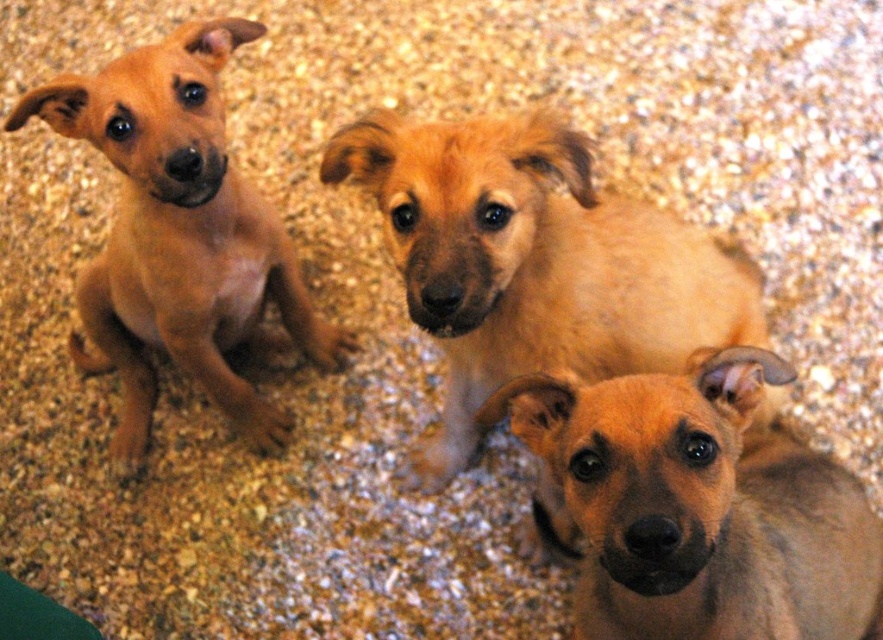
Question: Does brown fur puppy at center have a lesser width compared to matte brown puppy at left?

Choices:
 (A) yes
 (B) no

Answer: (A)

Question: Observing the image, what is the correct spatial positioning of light brown fur at center in reference to matte brown puppy at left?

Choices:
 (A) above
 (B) below

Answer: (B)

Question: Which object is positioned farthest from the matte brown puppy at left?

Choices:
 (A) brown fur puppy at center
 (B) light brown fur at center

Answer: (A)

Question: Which point is closer to the camera?

Choices:
 (A) matte brown puppy at left
 (B) light brown fur at center

Answer: (B)

Question: Does brown fur puppy at center appear over matte brown puppy at left?

Choices:
 (A) no
 (B) yes

Answer: (A)

Question: Estimate the real-world distances between objects in this image. Which object is farther from the matte brown puppy at left?

Choices:
 (A) brown fur puppy at center
 (B) light brown fur at center

Answer: (A)